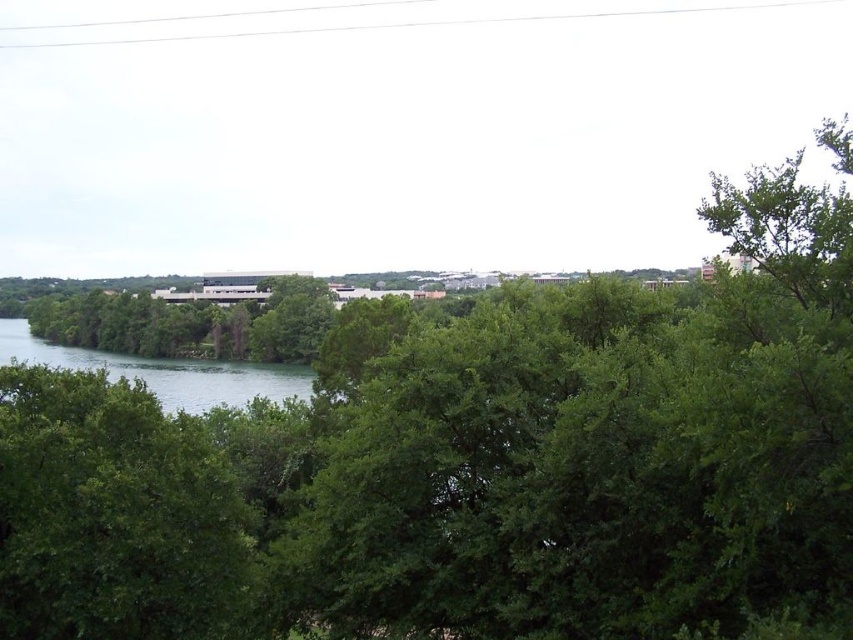
Question: Where is green leafy tree at left located in relation to green water at lower left in the image?

Choices:
 (A) right
 (B) left

Answer: (A)

Question: Can you confirm if green leafy tree at left is positioned above green water at lower left?

Choices:
 (A) yes
 (B) no

Answer: (A)

Question: Among these objects, which one is nearest to the camera?

Choices:
 (A) green leafy tree at left
 (B) green water at lower left

Answer: (A)

Question: Is green leafy tree at left smaller than green water at lower left?

Choices:
 (A) yes
 (B) no

Answer: (A)